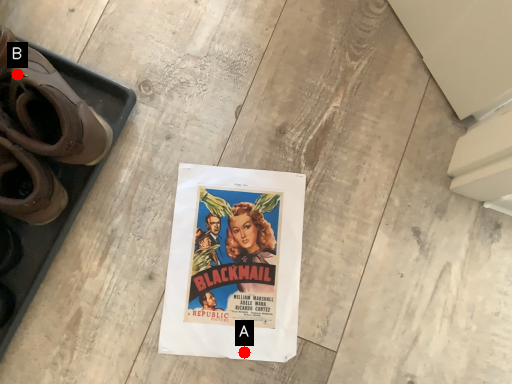
Question: Two points are circled on the image, labeled by A and B beside each circle. Which of the following is the farthest from the observer?

Choices:
 (A) A is further
 (B) B is further

Answer: (A)